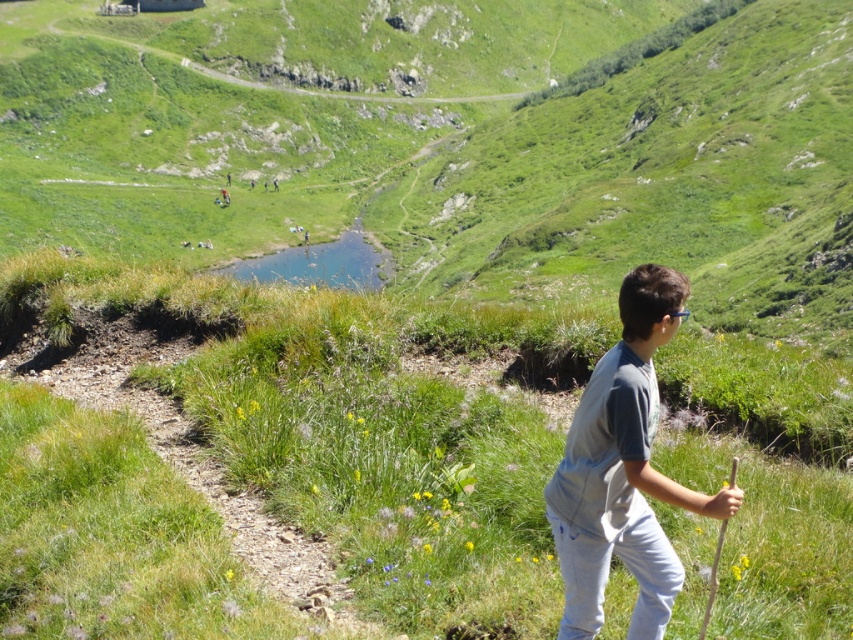
Between green grassy at center and gray cotton shirt at center, which one has more height?

green grassy at center is taller.

Which is behind, point (743, 481) or point (608, 436)?

The point (743, 481) is more distant.

Is point (697, 528) positioned in front of point (618, 387)?

No, (697, 528) is further to viewer.

I want to click on green grassy at center, so click(x=344, y=420).